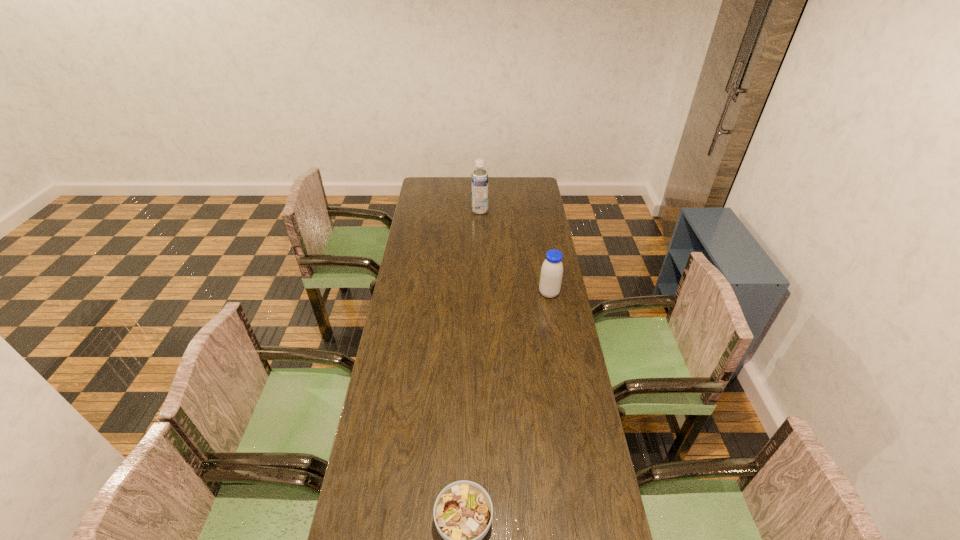
This screenshot has height=540, width=960. What are the coordinates of `the taller soya milk` in the screenshot? It's located at (479, 179).

Where is `the left soya milk`? The height and width of the screenshot is (540, 960). the left soya milk is located at coordinates (479, 179).

Find the location of `the nearer soya milk`. the nearer soya milk is located at coordinates (551, 274).

Where is `the rightmost object`? the rightmost object is located at coordinates (551, 274).

Find the location of a particular element. This screenshot has height=540, width=960. blank area located 0.140m on the label of the tallest object is located at coordinates (514, 211).

Find the location of a particular element. vacant space located on the front of the second nearest object is located at coordinates (563, 369).

Image resolution: width=960 pixels, height=540 pixels. Find the location of `object at the right edge`. object at the right edge is located at coordinates (551, 274).

Identify the location of free region at the far edge of the desktop. (495, 189).

The height and width of the screenshot is (540, 960). I want to click on vacant space at the left edge of the desktop, so click(411, 457).

The height and width of the screenshot is (540, 960). In order to click on free space at the right edge in this screenshot , I will do `click(526, 288)`.